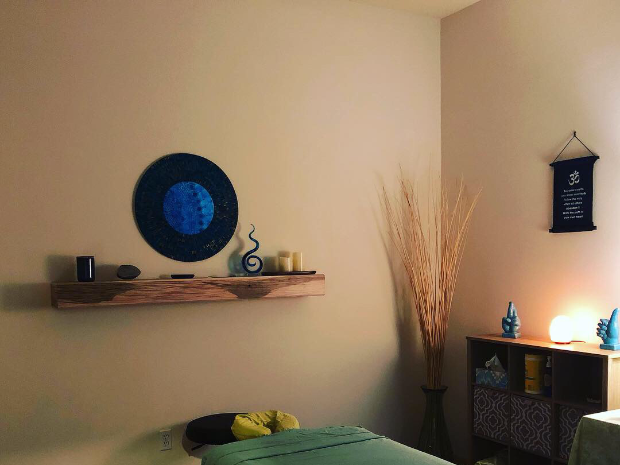
The image size is (620, 465). Identify the location of outlet cover. (167, 437).